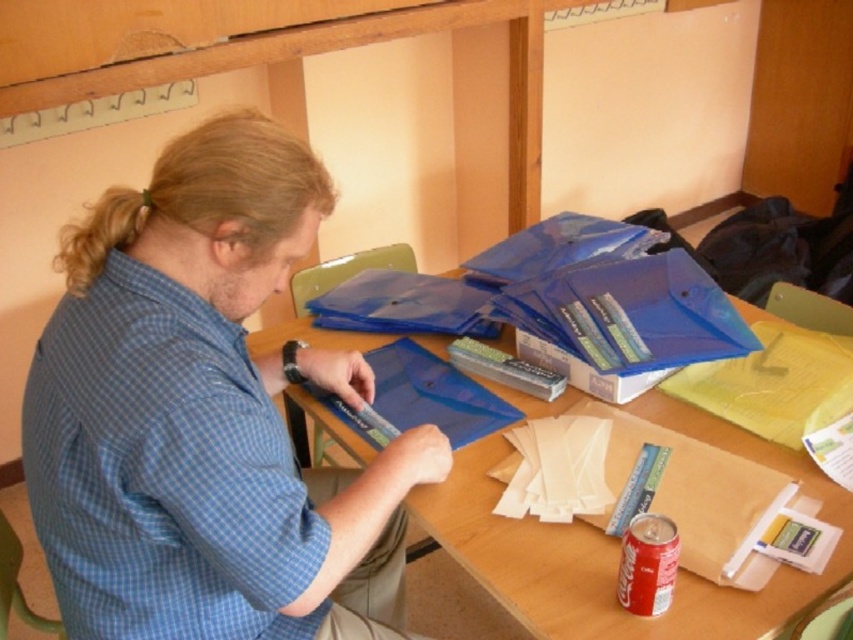
Does white matte paper at lower center appear under blonde hair at upper left?

Indeed, white matte paper at lower center is positioned under blonde hair at upper left.

Is white matte paper at lower center bigger than blonde hair at upper left?

No.

Does point (556, 424) come in front of point (82, 237)?

No, it is behind (82, 237).

In order to click on white matte paper at lower center in this screenshot , I will do `click(556, 468)`.

Between point (225, 576) and point (79, 236), which one is positioned behind?

The point (79, 236) is behind.

Can you confirm if blue matte folder at center is smaller than blonde hair at upper left?

No, blue matte folder at center is not smaller than blonde hair at upper left.

Who is more forward, (93, 216) or (82, 227)?

Point (93, 216)

Find the location of a particular element. This screenshot has height=640, width=853. blue matte folder at center is located at coordinates (206, 417).

Does blue matte folder at center appear on the right side of translucent plastic table at center?

In fact, blue matte folder at center is to the left of translucent plastic table at center.

Which is below, blue matte folder at center or translucent plastic table at center?

Positioned lower is translucent plastic table at center.

Does point (136, 561) lie in front of point (488, 440)?

Yes.

The image size is (853, 640). What are the coordinates of `blue matte folder at center` in the screenshot? It's located at (206, 417).